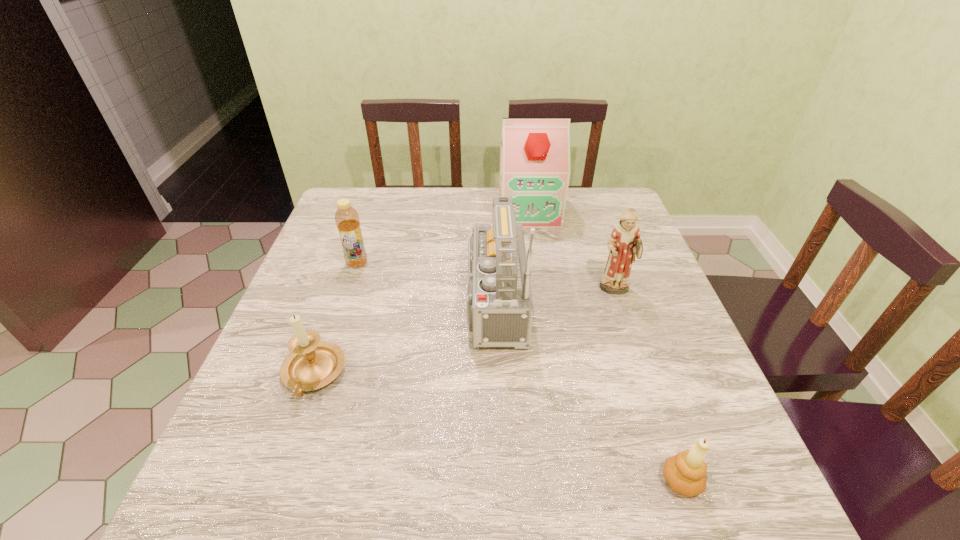
Locate an element on the screen. This screenshot has width=960, height=540. the farthest object is located at coordinates (535, 152).

You are a GUI agent. You are given a task and a screenshot of the screen. Output one action in this format:
    pyautogui.click(x=<x>, y=<y>)
    Task: Click on the radio receiver
    The image size is (960, 540).
    Given the screenshot: What is the action you would take?
    (x=499, y=309)

The height and width of the screenshot is (540, 960). What are the coordinates of `figurine` in the screenshot? It's located at (624, 244).

Identify the location of the third shortest object. (347, 220).

Find the location of a particular element. the taller candle_holder is located at coordinates (312, 364).

I want to click on the farther candle_holder, so click(x=312, y=364).

At what (x,y) coordinates should I click in order to perform the action: click on the nearest object. Please return your answer as a coordinate pair (x, y). Looking at the image, I should click on (685, 472).

Locate an element on the screen. The height and width of the screenshot is (540, 960). the nearer candle_holder is located at coordinates (685, 472).

Find the location of `blank space located 0.270m with the cap open on the farthest object`. blank space located 0.270m with the cap open on the farthest object is located at coordinates (541, 292).

The image size is (960, 540). I want to click on vacant space situated 0.260m on the front-facing side of the radio receiver, so click(337, 303).